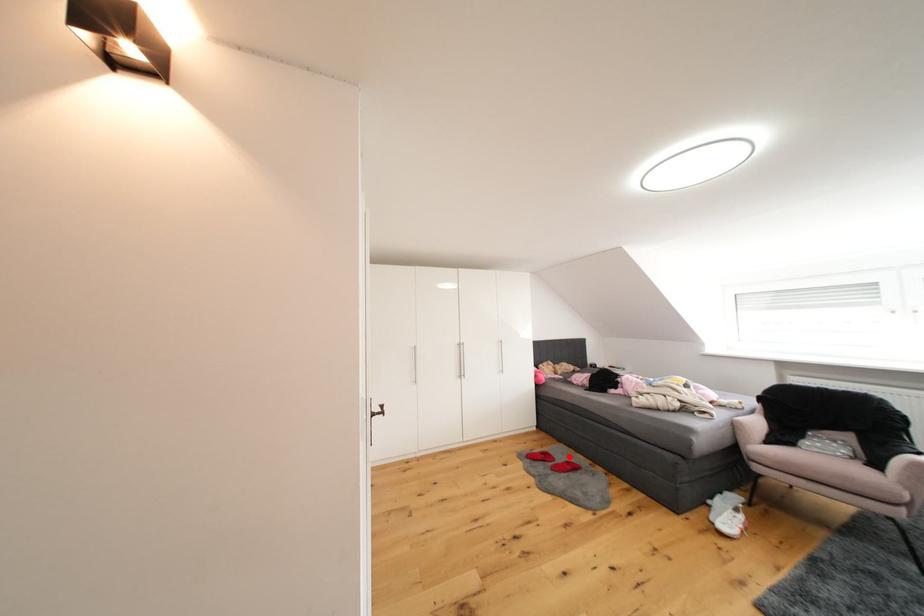
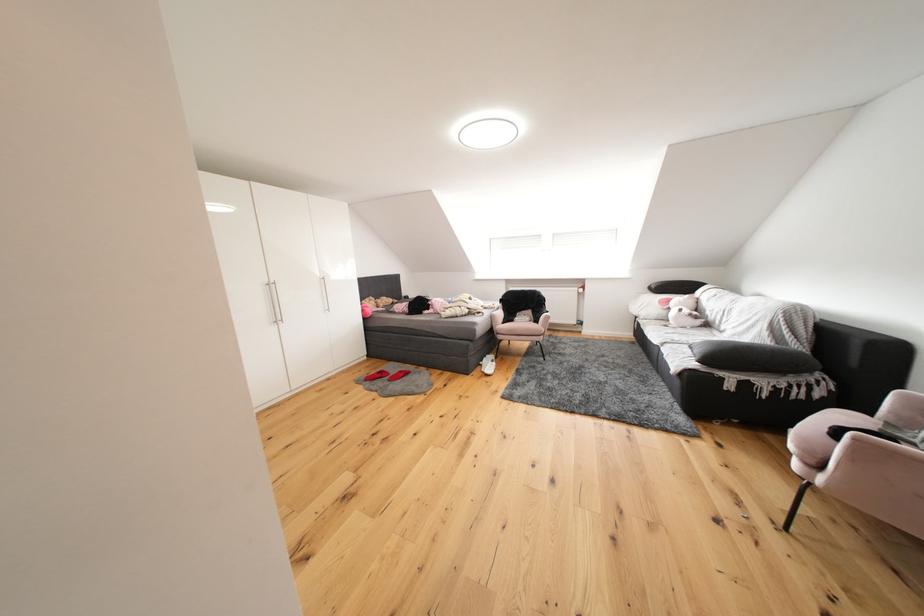
Locate, in the second image, the point that corresponds to the highlighted location in the first image.

(402, 371)